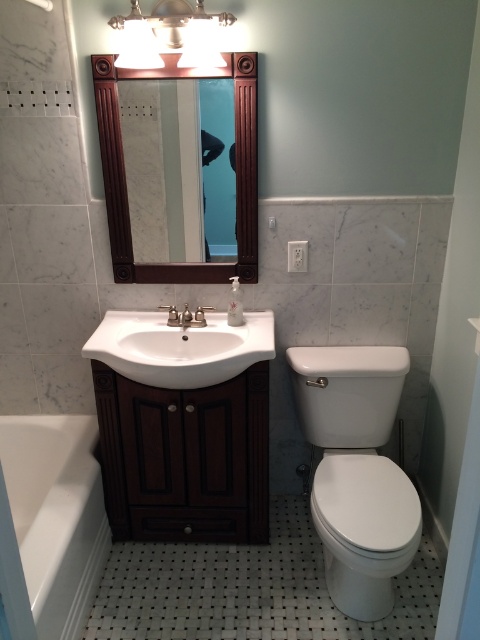
Can you confirm if white ceramic sink at center is bigger than silver metallic faucet at sink center?

Yes, white ceramic sink at center is bigger than silver metallic faucet at sink center.

Between white ceramic sink at center and silver metallic faucet at sink center, which one appears on the left side from the viewer's perspective?

white ceramic sink at center

Is point (196, 326) farther from camera compared to point (187, 321)?

Yes, it is behind point (187, 321).

Identify the location of white ceramic sink at center. (180, 348).

Does white glossy bathtub at lower left appear on the right side of silver metallic faucet at sink center?

Incorrect, white glossy bathtub at lower left is not on the right side of silver metallic faucet at sink center.

Which is behind, point (100, 548) or point (186, 304)?

The point (186, 304) is more distant.

Who is more distant from viewer, (x=64, y=484) or (x=180, y=314)?

Point (x=180, y=314)

Locate an element on the screen. white glossy bathtub at lower left is located at coordinates (56, 515).

Consider the image. Between white glossy toilet at lower right and silver metallic faucet at sink center, which one has less height?

silver metallic faucet at sink center

Is white glossy toilet at lower right further to camera compared to silver metallic faucet at sink center?

No, white glossy toilet at lower right is closer to the viewer.

Where is `white glossy toilet at lower right`? The height and width of the screenshot is (640, 480). white glossy toilet at lower right is located at coordinates (363, 529).

I want to click on white glossy toilet at lower right, so click(x=363, y=529).